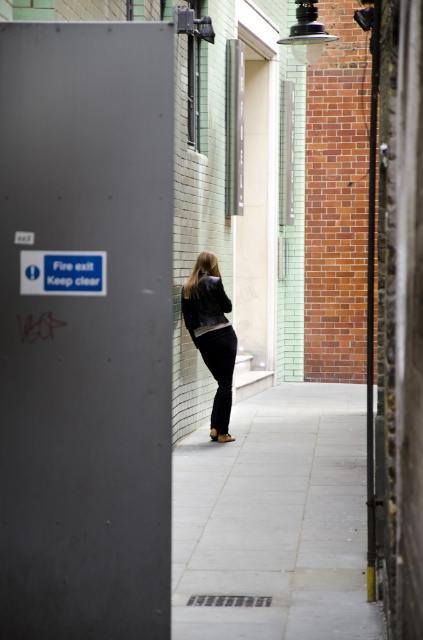
Question: Observing the image, what is the correct spatial positioning of gray concrete pavement at center in reference to matte black jacket at center?

Choices:
 (A) below
 (B) above

Answer: (A)

Question: Which object is closer to the camera taking this photo?

Choices:
 (A) matte black jacket at center
 (B) gray concrete pavement at center

Answer: (B)

Question: Among these points, which one is farthest from the camera?

Choices:
 (A) (299, 456)
 (B) (219, 428)

Answer: (B)

Question: Which object appears closest to the camera in this image?

Choices:
 (A) matte black jacket at center
 (B) gray concrete pavement at center

Answer: (B)

Question: Can you confirm if gray concrete pavement at center is positioned above matte black jacket at center?

Choices:
 (A) yes
 (B) no

Answer: (B)

Question: Can you confirm if gray concrete pavement at center is smaller than matte black jacket at center?

Choices:
 (A) no
 (B) yes

Answer: (A)